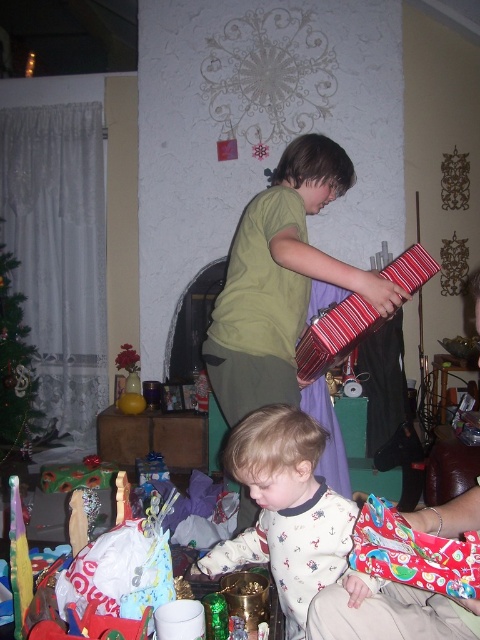
You are organizing a gift exchange event and need to place the printed fabric wrapped gift at lower right and the matte red suitcase at center into boxes. The boxes available are only big enough for the larger item. Which object should you place in the box?

The matte red suitcase at center should be placed in the box because it is larger than the printed fabric wrapped gift at lower right.